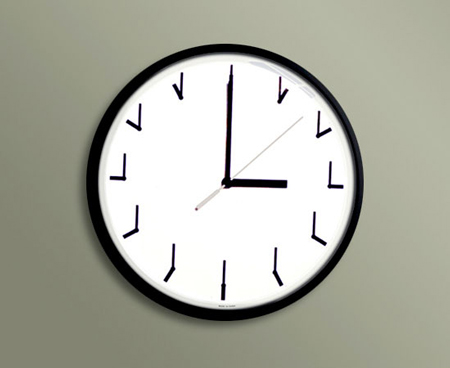
This screenshot has height=368, width=450. I want to click on empty space left of clock, so click(35, 186).